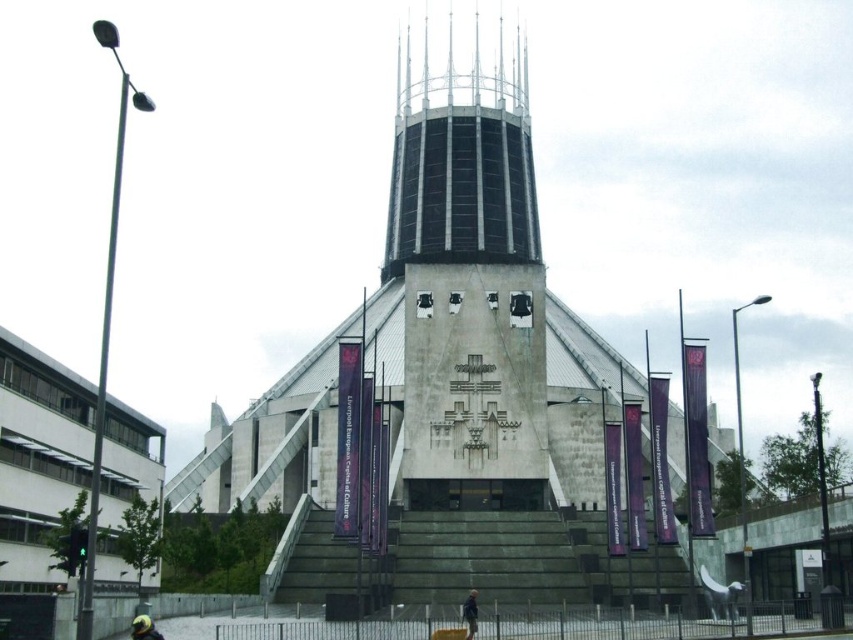
Question: From the image, what is the correct spatial relationship of black glass spire at center in relation to yellow matte helmet at lower left?

Choices:
 (A) below
 (B) above

Answer: (B)

Question: Is dark gray concrete stairs at center smaller than yellow matte helmet at lower left?

Choices:
 (A) yes
 (B) no

Answer: (B)

Question: Which point is farther to the camera?

Choices:
 (A) (462, 524)
 (B) (531, 186)

Answer: (B)

Question: Which object is closer to the camera taking this photo?

Choices:
 (A) black glass spire at center
 (B) yellow matte helmet at lower left
 (C) dark gray concrete stairs at center

Answer: (B)

Question: Which point is closer to the camera?

Choices:
 (A) yellow matte helmet at lower left
 (B) black glass spire at center
 (C) dark gray concrete stairs at center

Answer: (A)

Question: Can you confirm if black glass spire at center is smaller than yellow matte helmet at lower left?

Choices:
 (A) yes
 (B) no

Answer: (B)